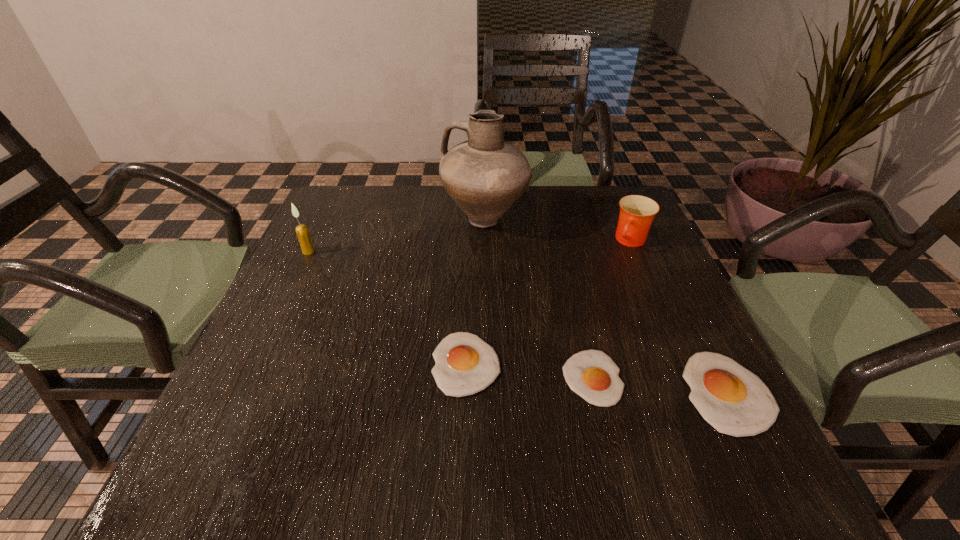
Given the evenly spaced egg yolks in the image, where should an extra egg yolk be added on the left to preserve the spacing? Please point to a vacant space. Please provide its 2D coordinates. Your answer should be formatted as a tuple, i.e. [(x, y)], where the tuple contains the x and y coordinates of a point satisfying the conditions above.

[(347, 351)]